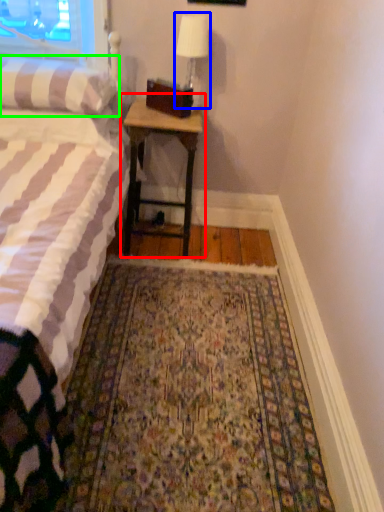
Question: Considering the real-world distances, which object is closest to nightstand (highlighted by a red box)? bedside lamp (highlighted by a blue box) or pillow (highlighted by a green box).

Choices:
 (A) bedside lamp
 (B) pillow

Answer: (B)